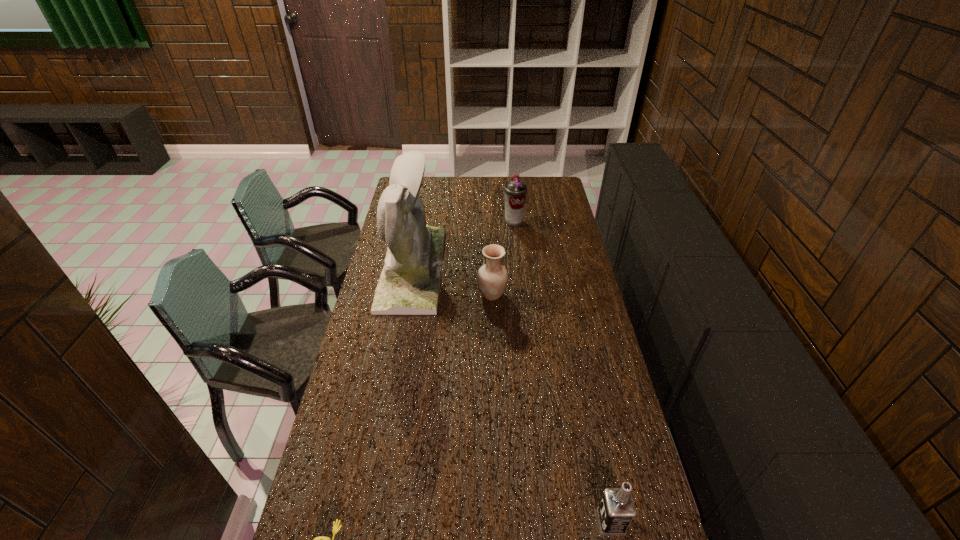
Find the location of a particular element. The height and width of the screenshot is (540, 960). the tallest object is located at coordinates (409, 284).

At what (x,y) coordinates should I click in order to perform the action: click on aerosol can. Please return your answer as a coordinate pair (x, y). This screenshot has width=960, height=540. Looking at the image, I should click on 515,190.

Find the location of a particular element. the farthest object is located at coordinates (515, 190).

Where is `the third object from left to right`? Image resolution: width=960 pixels, height=540 pixels. the third object from left to right is located at coordinates (492, 278).

Locate an element on the screen. the rightmost object is located at coordinates (616, 511).

I want to click on free location located on the base of the tallest object, so click(522, 268).

Find the location of a particular element. This screenshot has height=540, width=960. vacant region located 0.180m on the front of the second object from right to left is located at coordinates (516, 251).

This screenshot has width=960, height=540. What are the coordinates of `vacant space located 0.150m on the front of the third object from right to left` in the screenshot? It's located at (493, 334).

In order to click on free space located 0.400m on the front label of the rightmost object in this screenshot , I will do `click(444, 522)`.

This screenshot has width=960, height=540. Identify the location of free space located 0.130m on the front label of the rightmost object. (548, 522).